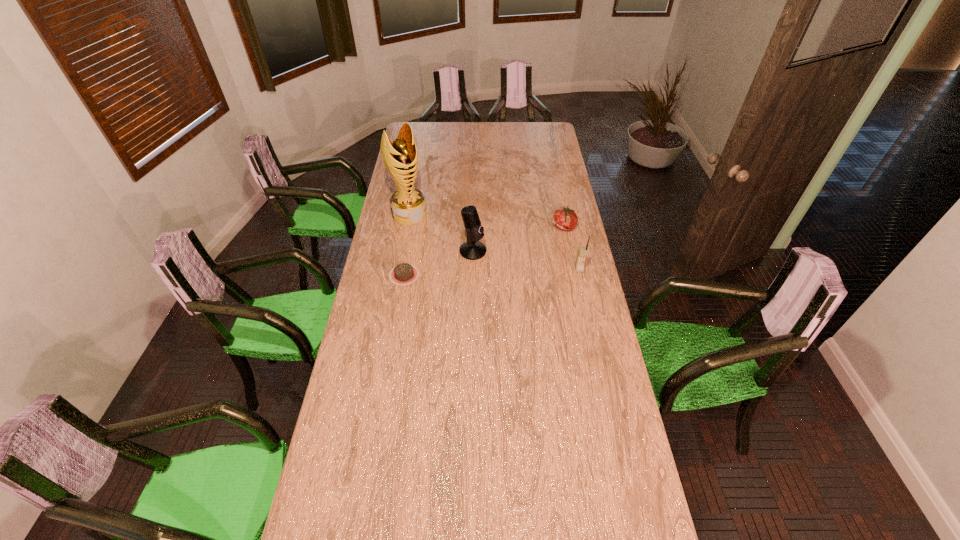
Where is `chocolate cake`? chocolate cake is located at coordinates (403, 274).

Identify the location of the third tallest object. The image size is (960, 540). (582, 252).

Where is `the tallest object`? The height and width of the screenshot is (540, 960). the tallest object is located at coordinates (408, 207).

The width and height of the screenshot is (960, 540). I want to click on tomato, so click(566, 219).

Find the location of a particular element. the third object from left to right is located at coordinates (472, 249).

Where is `the fourth shortest object`? the fourth shortest object is located at coordinates (472, 249).

Find the location of a particular element. The height and width of the screenshot is (540, 960). vacant region located on the front of the shortest object is located at coordinates (392, 354).

This screenshot has height=540, width=960. What are the coordinates of `free point located 0.090m on the front of the cellular telephone, where the keypad is located` in the screenshot? It's located at (584, 288).

Image resolution: width=960 pixels, height=540 pixels. What are the coordinates of `vacant region located on the front-facing side of the award` in the screenshot? It's located at (447, 254).

This screenshot has width=960, height=540. Find the location of `vacant space located 0.110m on the front-facing side of the award`. vacant space located 0.110m on the front-facing side of the award is located at coordinates (430, 235).